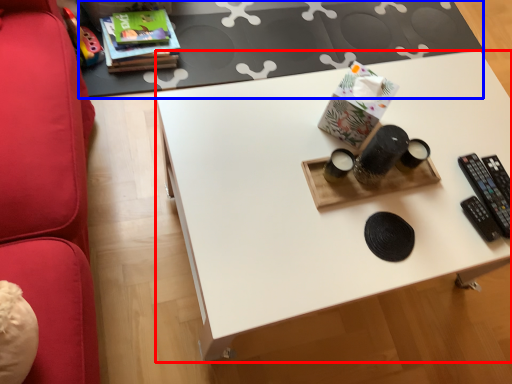
Question: Which of the following is the farthest to the observer, desk (highlighted by a red box) or table (highlighted by a blue box)?

Choices:
 (A) desk
 (B) table

Answer: (B)